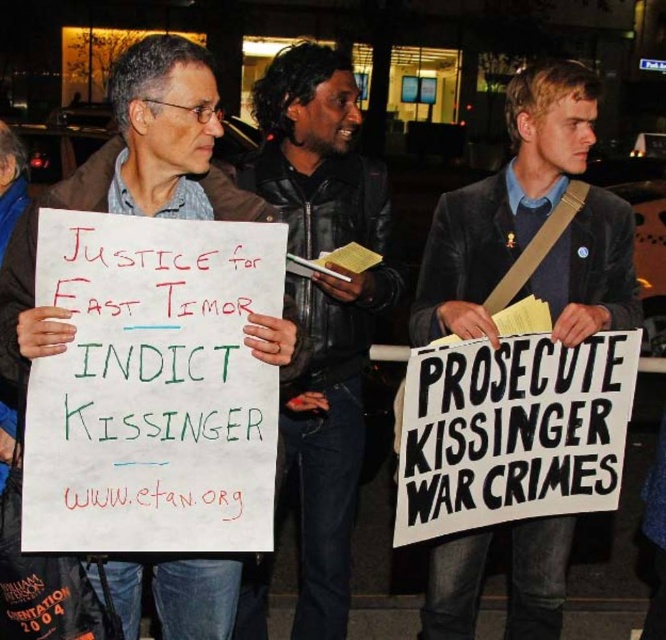
You are a photographer trying to capture a closeup of the dark gray suit at center and the black leather jacket at center in the protest scene. Your camera has a maximum focus range of 20 inches. Can you capture both items in a single focused shot without moving the camera?

The distance between the dark gray suit at center and the black leather jacket at center is 23.22 inches, which exceeds the camera maximum focus range of 20 inches. Therefore, you cannot capture both items in a single focused shot without moving the camera.

You are a photographer trying to capture a clear shot of both the dark gray suit at center and the white paper sign at left. Since you want to focus on the sign, which object should you adjust your camera focus to prioritize?

The dark gray suit at center is closer to the viewer than the white paper sign at left, so to focus on the sign, you need to adjust the focus to the white paper sign at left which is further away.

You are a photographer trying to capture the protest scene. You want to focus on the dark gray suit at center. Where should you aim your camera to capture it?

You should aim your camera at point (x=505, y=202) to capture the dark gray suit at center.